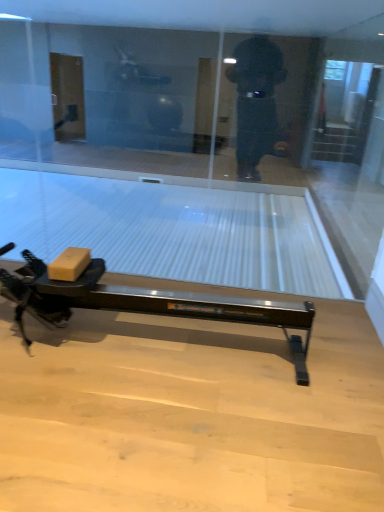
Question: Is matte cardboard box at lower left outside of transparent glass screen door at upper right?

Choices:
 (A) no
 (B) yes

Answer: (B)

Question: From the image's perspective, is matte cardboard box at lower left on top of transparent glass screen door at upper right?

Choices:
 (A) yes
 (B) no

Answer: (B)

Question: Is the position of matte cardboard box at lower left more distant than that of transparent glass screen door at upper right?

Choices:
 (A) yes
 (B) no

Answer: (B)

Question: Does matte cardboard box at lower left have a lesser height compared to transparent glass screen door at upper right?

Choices:
 (A) yes
 (B) no

Answer: (A)

Question: Can you confirm if matte cardboard box at lower left is positioned to the left of transparent glass screen door at upper right?

Choices:
 (A) yes
 (B) no

Answer: (A)

Question: From a real-world perspective, is matte cardboard box at lower left beneath transparent glass screen door at upper right?

Choices:
 (A) yes
 (B) no

Answer: (A)

Question: Is transparent glass screen door at upper right at the right side of matte cardboard box at lower left?

Choices:
 (A) yes
 (B) no

Answer: (A)

Question: Is transparent glass screen door at upper right further to the viewer compared to matte cardboard box at lower left?

Choices:
 (A) yes
 (B) no

Answer: (A)

Question: Is transparent glass screen door at upper right shorter than matte cardboard box at lower left?

Choices:
 (A) yes
 (B) no

Answer: (B)

Question: Considering the relative sizes of transparent glass screen door at upper right and matte cardboard box at lower left in the image provided, is transparent glass screen door at upper right bigger than matte cardboard box at lower left?

Choices:
 (A) no
 (B) yes

Answer: (B)

Question: Can you see transparent glass screen door at upper right touching matte cardboard box at lower left?

Choices:
 (A) yes
 (B) no

Answer: (B)

Question: From the image's perspective, would you say transparent glass screen door at upper right is shown under matte cardboard box at lower left?

Choices:
 (A) no
 (B) yes

Answer: (A)

Question: Does transparent glass at center turn towards matte cardboard box at lower left?

Choices:
 (A) yes
 (B) no

Answer: (A)